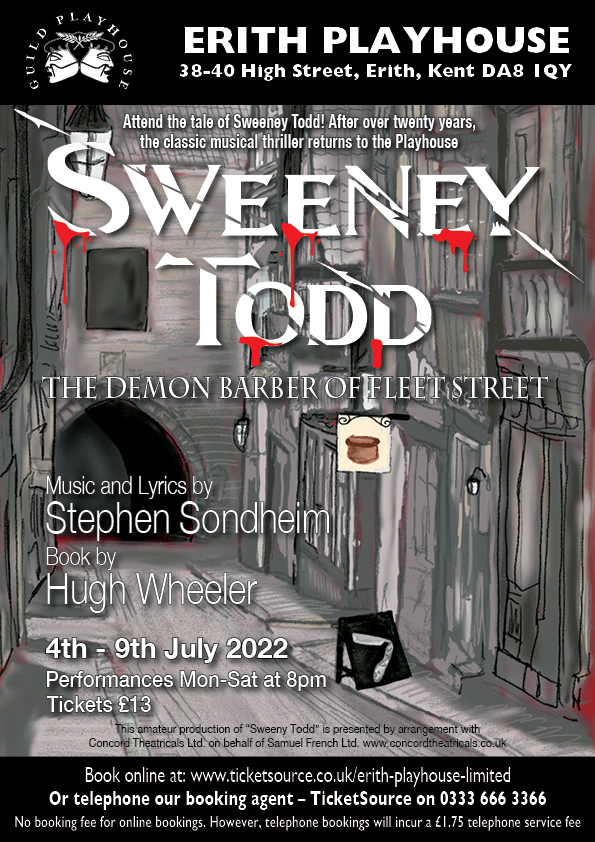
You are a GUI agent. You are given a task and a screenshot of the screen. Output one action in this format:
    pyautogui.click(x=<x>, y=<y>)
    Task: Click on the archway
    This screenshot has width=595, height=842.
    Given the screenshot: What is the action you would take?
    pyautogui.click(x=65, y=419)